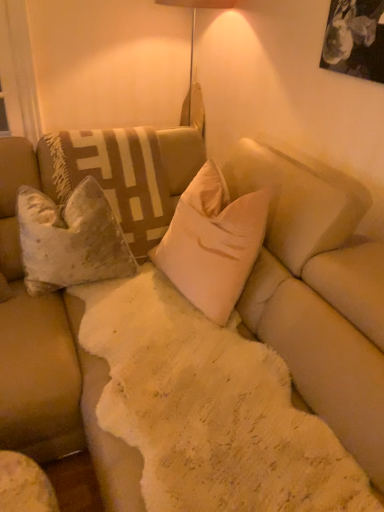
Question: Is beige velvet pillow at center, placed as the second pillow when sorted from left to right, spatially inside velvet beige pillow at left, which is the second pillow from right to left, or outside of it?

Choices:
 (A) inside
 (B) outside

Answer: (B)

Question: Considering their positions, is beige velvet pillow at center, the first pillow from the right, located in front of or behind velvet beige pillow at left, which is the second pillow from right to left?

Choices:
 (A) front
 (B) behind

Answer: (A)

Question: Is beige velvet pillow at center, placed as the second pillow when sorted from left to right, bigger or smaller than velvet beige pillow at left, which is the second pillow from right to left?

Choices:
 (A) big
 (B) small

Answer: (A)

Question: In terms of height, does velvet beige pillow at left, the first pillow positioned from the left, look taller or shorter compared to beige velvet pillow at center, placed as the second pillow when sorted from left to right?

Choices:
 (A) tall
 (B) short

Answer: (B)

Question: Considering their positions, is velvet beige pillow at left, which is the second pillow from right to left, located in front of or behind beige velvet pillow at center, placed as the second pillow when sorted from left to right?

Choices:
 (A) front
 (B) behind

Answer: (B)

Question: From a real-world perspective, is velvet beige pillow at left, the first pillow positioned from the left, physically located above or below beige velvet pillow at center, placed as the second pillow when sorted from left to right?

Choices:
 (A) above
 (B) below

Answer: (B)

Question: Looking at their shapes, would you say velvet beige pillow at left, which is the second pillow from right to left, is wider or thinner than beige velvet pillow at center, the first pillow from the right?

Choices:
 (A) wide
 (B) thin

Answer: (A)